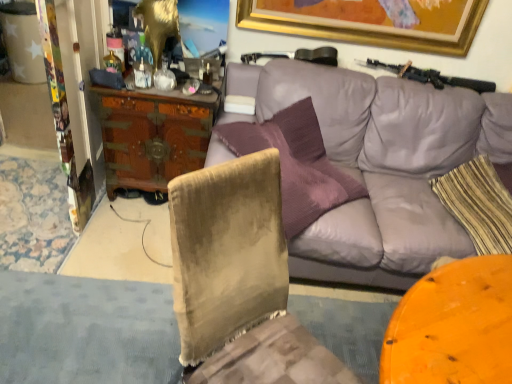
Question: Can you confirm if striped fabric pillow at right is bigger than wooden carved desk at center left?

Choices:
 (A) yes
 (B) no

Answer: (B)

Question: Considering the relative sizes of striped fabric pillow at right and wooden carved desk at center left in the image provided, is striped fabric pillow at right wider than wooden carved desk at center left?

Choices:
 (A) yes
 (B) no

Answer: (B)

Question: Considering the relative sizes of striped fabric pillow at right and wooden carved desk at center left in the image provided, is striped fabric pillow at right thinner than wooden carved desk at center left?

Choices:
 (A) no
 (B) yes

Answer: (B)

Question: Could you tell me if striped fabric pillow at right is facing wooden carved desk at center left?

Choices:
 (A) no
 (B) yes

Answer: (B)

Question: From a real-world perspective, is striped fabric pillow at right physically below wooden carved desk at center left?

Choices:
 (A) yes
 (B) no

Answer: (B)

Question: Is wooden carved desk at center left spatially inside purple leather couch at upper center, or outside of it?

Choices:
 (A) outside
 (B) inside

Answer: (A)

Question: From the image's perspective, relative to purple leather couch at upper center, is wooden carved desk at center left above or below?

Choices:
 (A) above
 (B) below

Answer: (A)

Question: Considering the positions of wooden carved desk at center left and purple leather couch at upper center in the image, is wooden carved desk at center left taller or shorter than purple leather couch at upper center?

Choices:
 (A) tall
 (B) short

Answer: (B)

Question: From a real-world perspective, is wooden carved desk at center left positioned above or below purple leather couch at upper center?

Choices:
 (A) above
 (B) below

Answer: (B)

Question: From the image's perspective, is black matte shotgun at upper right above or below purple leather couch at upper center?

Choices:
 (A) above
 (B) below

Answer: (A)

Question: Is black matte shotgun at upper right bigger or smaller than purple leather couch at upper center?

Choices:
 (A) small
 (B) big

Answer: (A)

Question: Is black matte shotgun at upper right taller or shorter than purple leather couch at upper center?

Choices:
 (A) short
 (B) tall

Answer: (A)

Question: Does point (480, 86) appear closer or farther from the camera than point (290, 271)?

Choices:
 (A) closer
 (B) farther

Answer: (B)

Question: Looking at the image, does velvet chair at lower left seem bigger or smaller compared to purple leather couch at upper center?

Choices:
 (A) big
 (B) small

Answer: (B)

Question: Looking at their shapes, would you say velvet chair at lower left is wider or thinner than purple leather couch at upper center?

Choices:
 (A) wide
 (B) thin

Answer: (B)